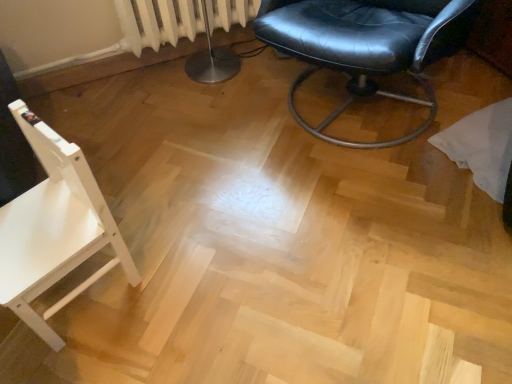
The image size is (512, 384). What are the coordinates of `empty space that is in between black leather chair at center, which appears as the 2th chair when viewed from the left, and white wood chair at left, arranged as the second chair when viewed from the top` in the screenshot? It's located at (231, 194).